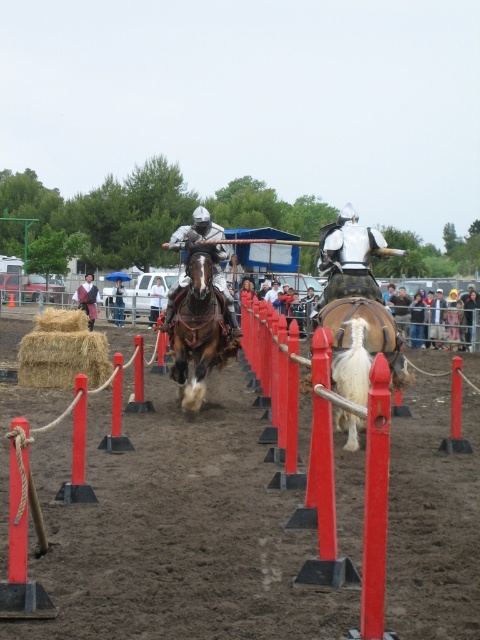
From the picture: You are a knight preparing to ride through the course. You notice the white woolen horse at center and the white fabric umbrella at center. Which object would you need to avoid hitting with your lance to ensure you stay on course?

The white fabric umbrella at center is larger than the white woolen horse at center, so you should aim to avoid hitting the white fabric umbrella at center with your lance to stay on course.